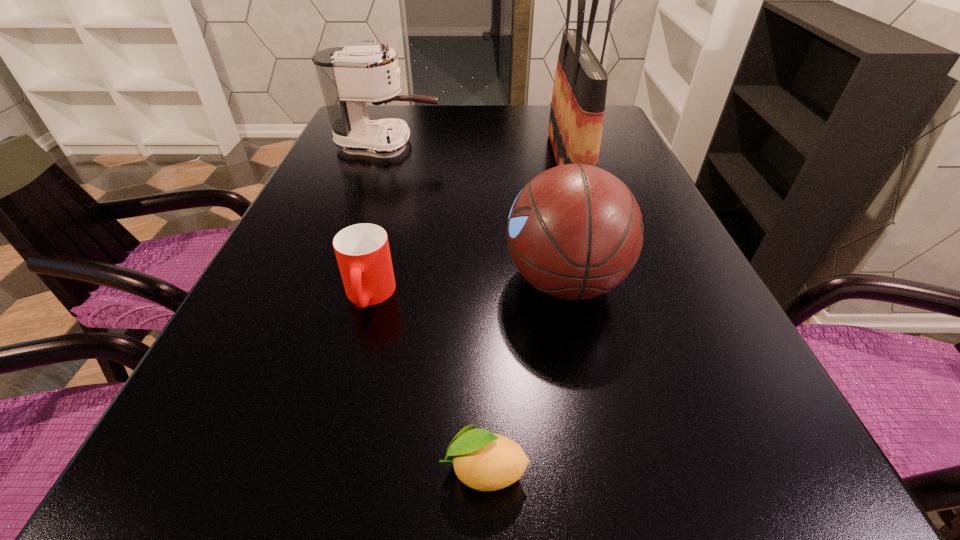
Find the location of a particular element. The width and height of the screenshot is (960, 540). blank area located on the front of the third shortest object is located at coordinates (619, 538).

Where is `free space located 0.090m on the side of the cup with the handle`? Image resolution: width=960 pixels, height=540 pixels. free space located 0.090m on the side of the cup with the handle is located at coordinates click(350, 366).

Identify the location of vacant region located 0.090m with leaves positioned above the nearest object. [x=369, y=469].

Where is `vacant space located 0.210m with leaves positioned above the nearest object`? This screenshot has height=540, width=960. vacant space located 0.210m with leaves positioned above the nearest object is located at coordinates (272, 469).

Where is `free space located with leaves positioned above the nearest object`? This screenshot has width=960, height=540. free space located with leaves positioned above the nearest object is located at coordinates (176, 469).

The image size is (960, 540). I want to click on shopping bag that is at the far edge, so click(x=577, y=110).

In order to click on coffee maker present at the far edge in this screenshot , I will do `click(349, 77)`.

Locate an element on the screen. This screenshot has width=960, height=540. object located in the near edge section of the desktop is located at coordinates (484, 461).

The height and width of the screenshot is (540, 960). Identify the location of object positioned at the left edge. (x=349, y=77).

Where is `shopping bag situated at the right edge`? This screenshot has height=540, width=960. shopping bag situated at the right edge is located at coordinates (577, 110).